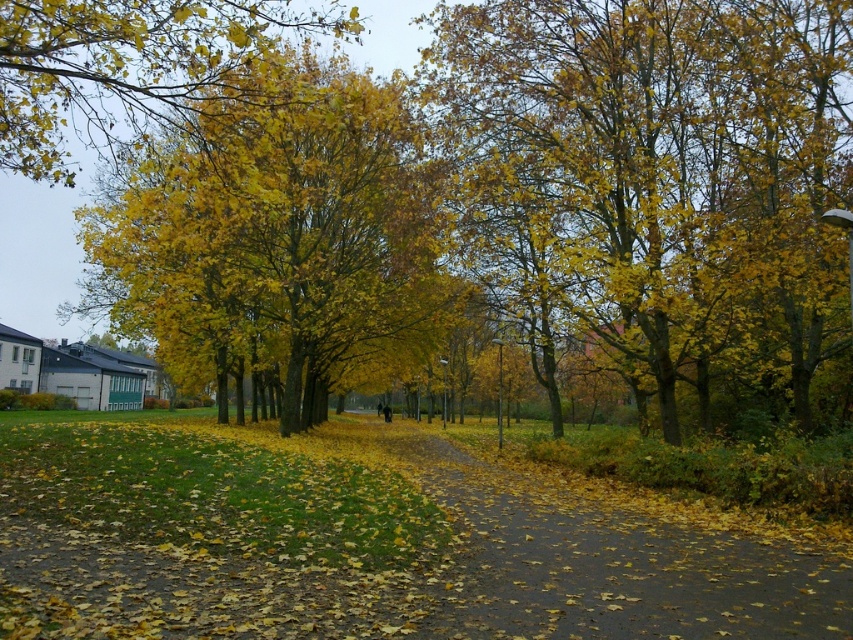
Question: Which point is farther from the camera taking this photo?

Choices:
 (A) (679, 349)
 (B) (157, 243)
 (C) (697, 577)

Answer: (B)

Question: Which object is the farthest from the yellow matte leaves at upper left?

Choices:
 (A) yellow leafy tree at center
 (B) yellow-green leaves at center

Answer: (B)

Question: Can you confirm if yellow leafy tree at center is positioned below brown asphalt path at center?

Choices:
 (A) no
 (B) yes

Answer: (A)

Question: Is yellow-green leaves at center positioned at the back of yellow leafy tree at center?

Choices:
 (A) no
 (B) yes

Answer: (B)

Question: Does yellow-green leaves at center have a smaller size compared to yellow leafy tree at center?

Choices:
 (A) no
 (B) yes

Answer: (B)

Question: Which point is farther from the camera taking this photo?

Choices:
 (A) (78, 49)
 (B) (498, 515)
 (C) (274, 248)
 (D) (671, 362)

Answer: (A)